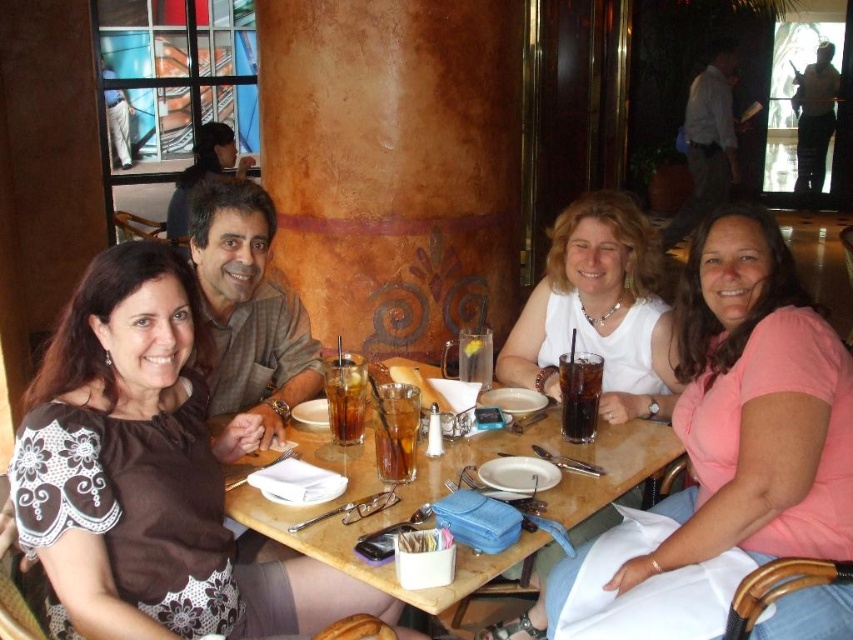
Question: Which object is closer to the camera taking this photo?

Choices:
 (A) matte white blouse at center
 (B) white matte shirt at center
 (C) brown fabric dress at left

Answer: (C)

Question: From the image, what is the correct spatial relationship of brown fabric dress at left in relation to matte white blouse at center?

Choices:
 (A) left
 (B) right

Answer: (A)

Question: Can you confirm if translucent glass beverage at table center is bigger than golden crispy bread at lower center?

Choices:
 (A) yes
 (B) no

Answer: (A)

Question: Does translucent glass beverage at table center have a lesser width compared to golden crispy bread at lower center?

Choices:
 (A) no
 (B) yes

Answer: (B)

Question: Which of the following is the farthest from the observer?

Choices:
 (A) (314, 568)
 (B) (838, 461)

Answer: (A)

Question: Which point is farther from the camera taking this photo?

Choices:
 (A) (659, 273)
 (B) (338, 636)
 (C) (402, 428)
 (D) (172, 618)

Answer: (A)